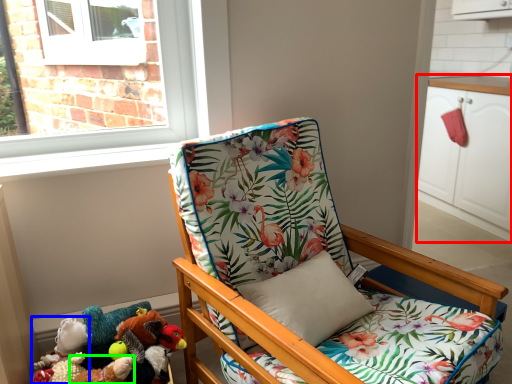
Question: Based on their relative distances, which object is nearer to cabinetry (highlighted by a red box)? Choose from toy (highlighted by a blue box) and toy (highlighted by a green box).

Choices:
 (A) toy
 (B) toy

Answer: (B)